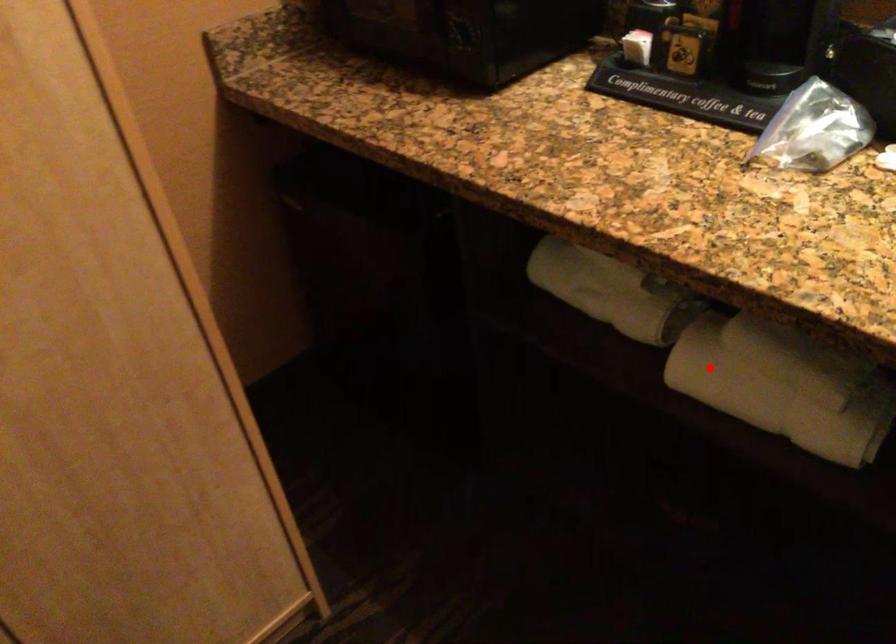
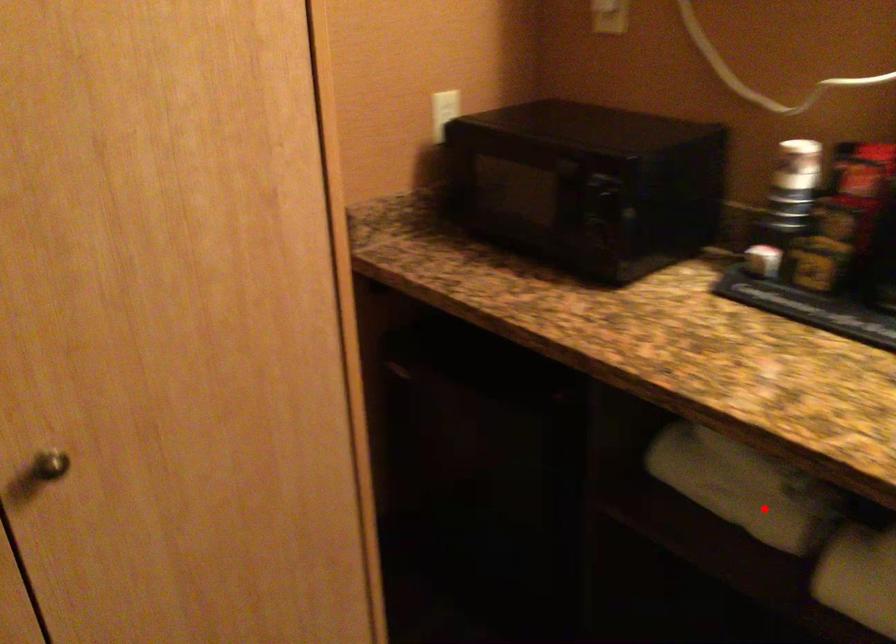
I am providing you with two images of the same scene from different viewpoints. A red point is marked on the first image and another point is marked on the second image. Is the marked point in image1 the same physical position as the marked point in image2?

No